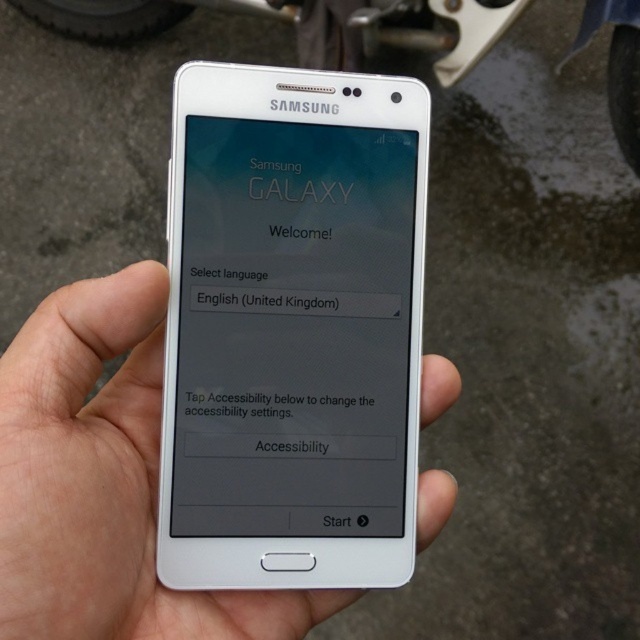
Question: Can you confirm if white glossy screen at center is positioned below metallic silver motorbike at upper center?

Choices:
 (A) yes
 (B) no

Answer: (A)

Question: Which point is farther to the camera?

Choices:
 (A) [634, 92]
 (B) [296, 266]
 (C) [29, 340]

Answer: (A)

Question: Does white glossy screen at center lie in front of metallic silver motorbike at upper center?

Choices:
 (A) no
 (B) yes

Answer: (B)

Question: Estimate the real-world distances between objects in this image. Which object is closer to the white matte phone at center?

Choices:
 (A) metallic silver motorbike at upper center
 (B) white glossy screen at center

Answer: (B)

Question: Can you confirm if white matte phone at center is bigger than metallic silver motorbike at upper center?

Choices:
 (A) no
 (B) yes

Answer: (A)

Question: Which object appears farthest from the camera in this image?

Choices:
 (A) white matte phone at center
 (B) metallic silver motorbike at upper center

Answer: (B)